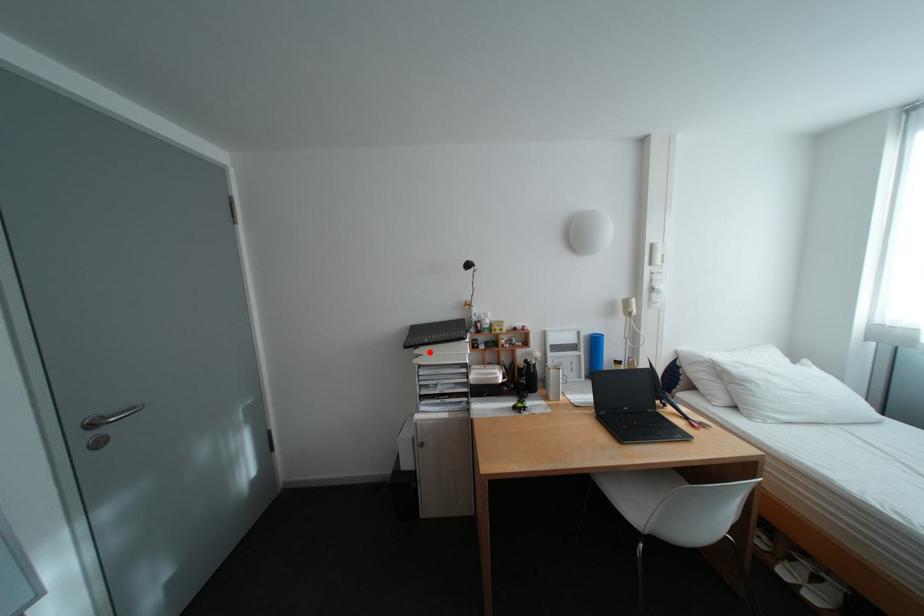
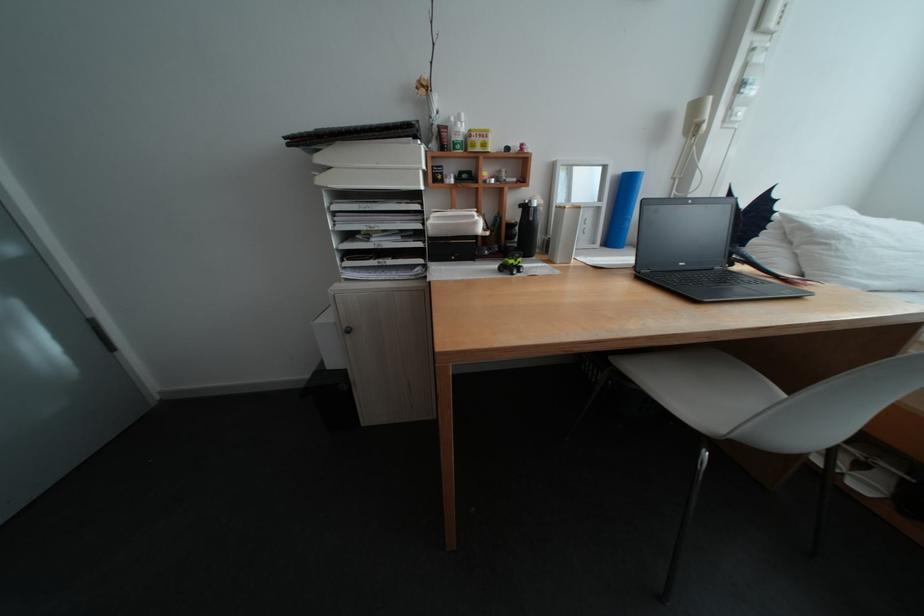
Locate, in the second image, the point that corresponds to the highlighted location in the first image.

(333, 160)